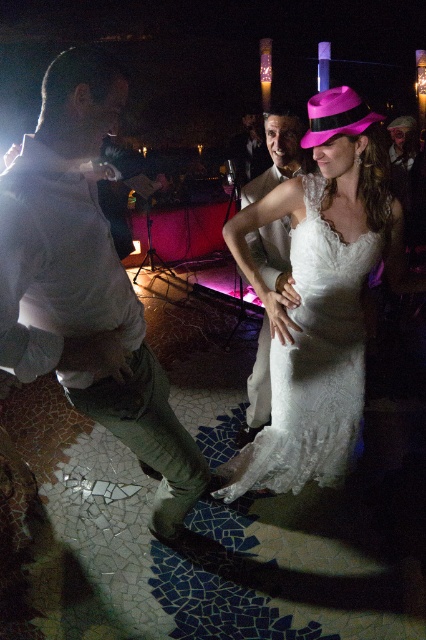
You are standing at the center of the dance floor at the wedding reception. You notice a point marked at coordinates (313,364). What object is located at that exact point?

The white lace dress at center is located at point (313,364).

You are a photographer at the wedding reception. You want to capture a photo of the white lace dress at center and the matte white suit at center such that both are clearly visible. Based on their positions, which one should you focus on first to ensure it appears sharp in the photo?

The white lace dress at center is positioned under the matte white suit at center, so you should focus on the matte white suit at center first to ensure it stays sharp, as it is closer to the camera.